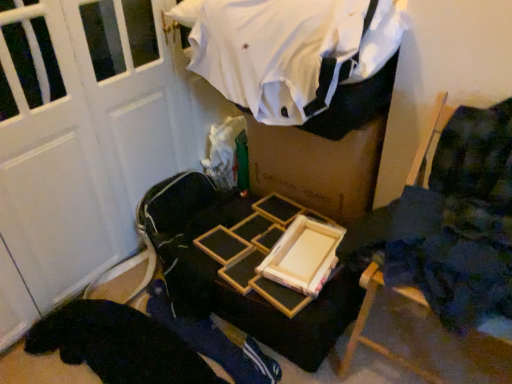
Question: Looking at their shapes, would you say blue fabric at center is wider or thinner than wooden frame at center?

Choices:
 (A) wide
 (B) thin

Answer: (A)

Question: From a real-world perspective, relative to wooden frame at center, is blue fabric at center vertically above or below?

Choices:
 (A) above
 (B) below

Answer: (B)

Question: Based on their relative distances, which object is nearer to the white cotton shirt at upper center?

Choices:
 (A) blue fabric at center
 (B) wooden chair at right
 (C) wooden frame at center

Answer: (C)

Question: Which is nearer to the blue fabric at center?

Choices:
 (A) wooden frame at center
 (B) wooden chair at right
 (C) white cotton shirt at upper center

Answer: (B)